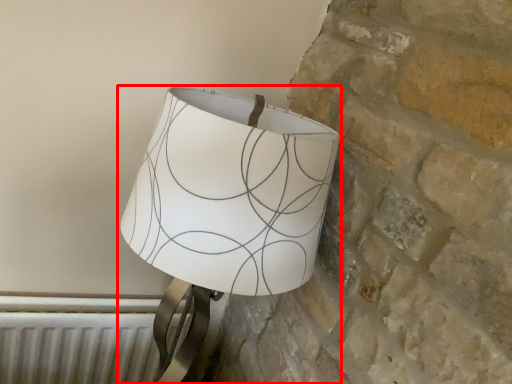
Question: From the image's perspective, what is the correct spatial relationship of lamp (annotated by the red box) in relation to radiator?

Choices:
 (A) below
 (B) above

Answer: (B)